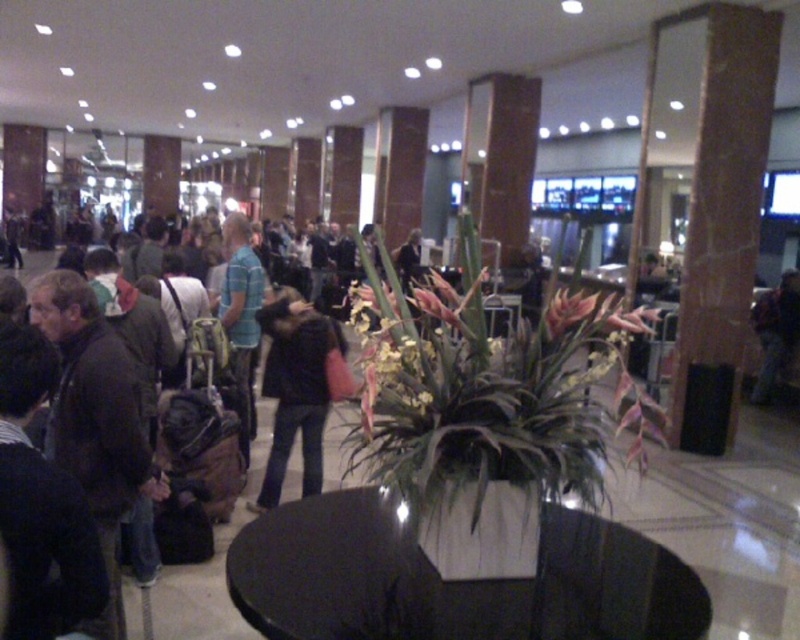
You are a photographer trying to capture a candid shot of the dark blue jeans at center without including the green leafy plant at center in the frame. Based on their positions, is this possible?

The green leafy plant at center is positioned on the left side of dark blue jeans at center. Since the plant is to the left of the jeans, you can adjust your angle to the right side of the jeans to exclude the plant from the frame.

You are a photographer positioned in the scene. You need to capture a photo that includes both the green leafy plant at center and the dark blue jeans at center. Based on their positions, which object should you focus on first to ensure both are in frame?

The green leafy plant at center is located below dark blue jeans at center, so you should focus on the dark blue jeans at center first to ensure both are in frame.